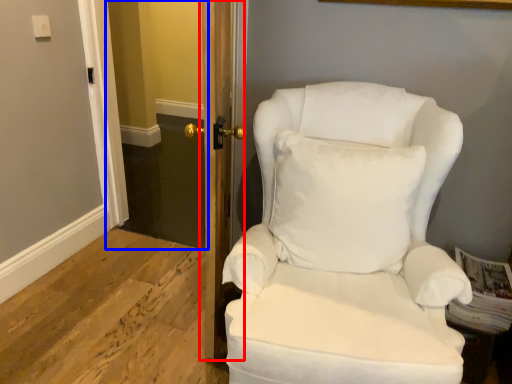
Question: Which of the following is the farthest to the observer, door (highlighted by a red box) or glass door (highlighted by a blue box)?

Choices:
 (A) door
 (B) glass door

Answer: (B)